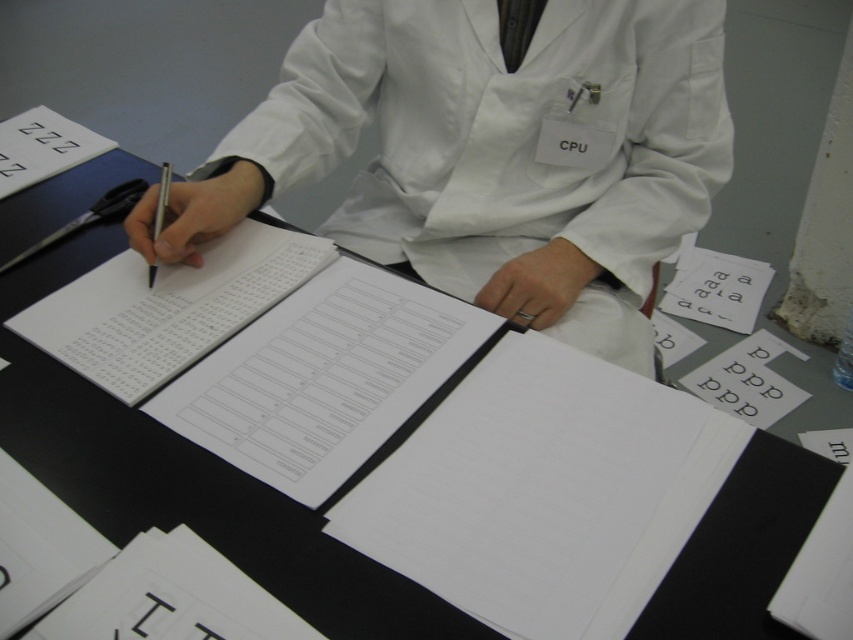
In the scene shown: You are a photographer trying to capture a closeup of the scene. You want to focus on the point at coordinate point (367,109) and point (164,180). Which point should you focus on first to ensure both are in focus?

Point (367,109) is further to the camera than point (164,180), so you should focus on point (164,180) first to ensure both are in focus.

You need to place both the white smooth lab coat at center and the metallic silver pen at left into a storage box. The box can only fit items that are smaller than the lab coat. Can you fit both items into the box?

The white smooth lab coat at center has a larger size compared to metallic silver pen at left. Since the box requires items smaller than the lab coat, the metallic silver pen at left can fit, but the lab coat itself cannot. Therefore, only the metallic silver pen at left can be placed in the box.

You are a scientist who needs to determine if your white smooth lab coat at center can completely cover the metallic silver pen at left on the table. Based on the scene description, can the lab coat cover the pen?

The white smooth lab coat at center is wider than the metallic silver pen at left, so yes, the lab coat can completely cover the pen.